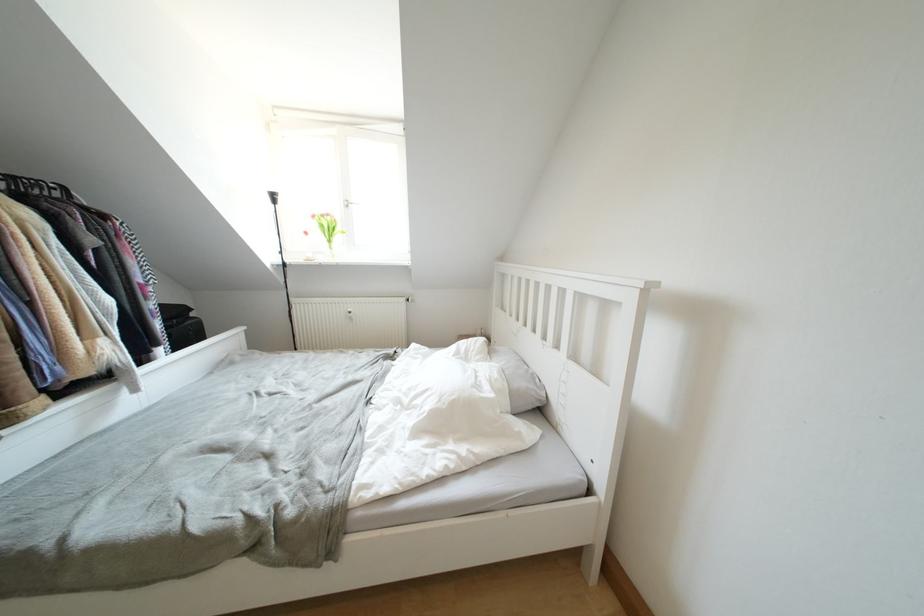
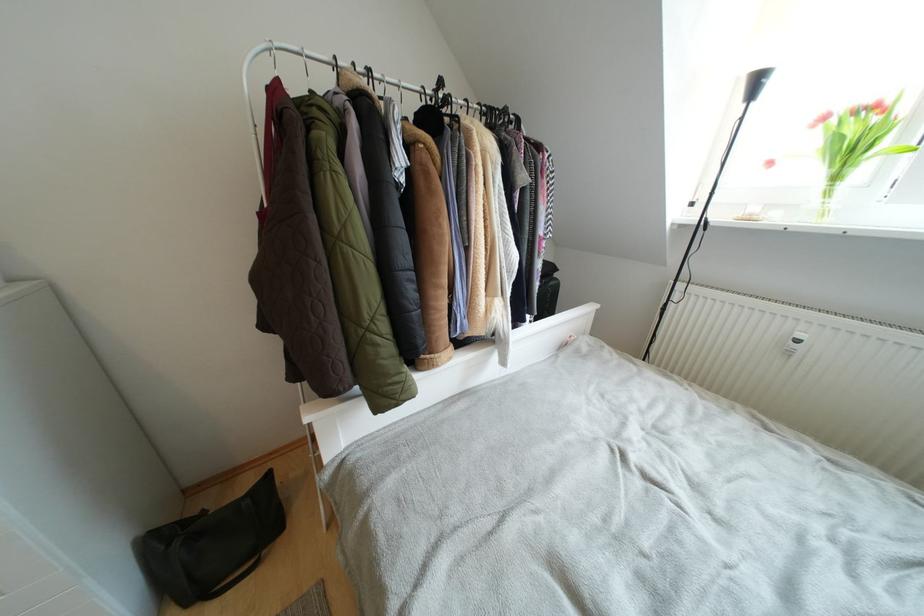
Locate, in the second image, the point that corresponds to (355,314) in the first image.

(805, 339)